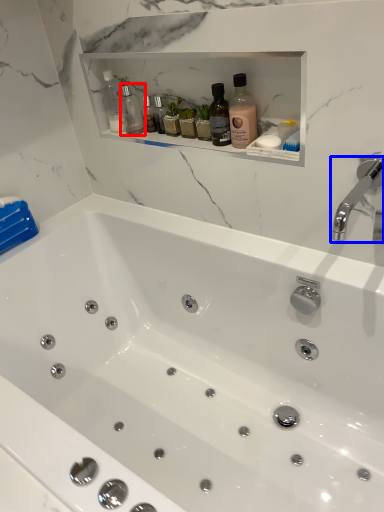
Question: Among these objects, which one is nearest to the camera, bottle (highlighted by a red box) or tap (highlighted by a blue box)?

Choices:
 (A) bottle
 (B) tap

Answer: (B)